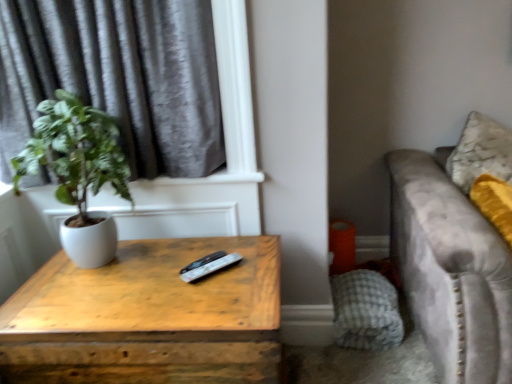
Identify the location of vacant location behind black plastic remote at center. (200, 248).